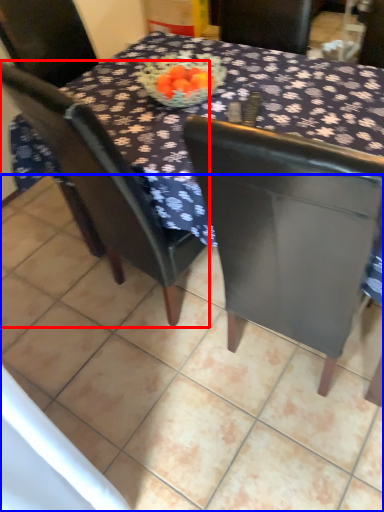
Question: Which point is closer to the camera, chair (highlighted by a red box) or tile (highlighted by a blue box)?

Choices:
 (A) chair
 (B) tile

Answer: (B)